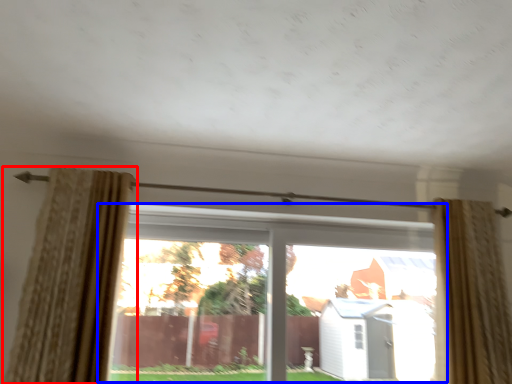
Question: Which point is further to the camera, curtain (highlighted by a red box) or window (highlighted by a blue box)?

Choices:
 (A) curtain
 (B) window

Answer: (B)